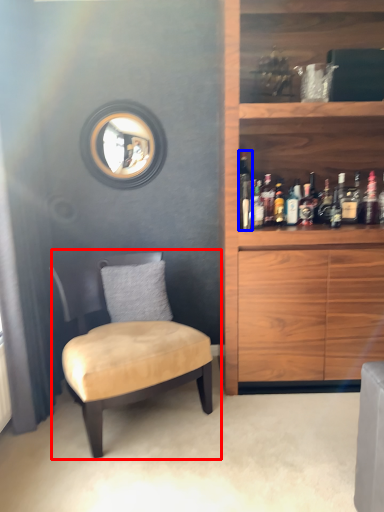
Question: Which object is further to the camera taking this photo, chair (highlighted by a red box) or bottle (highlighted by a blue box)?

Choices:
 (A) chair
 (B) bottle

Answer: (B)